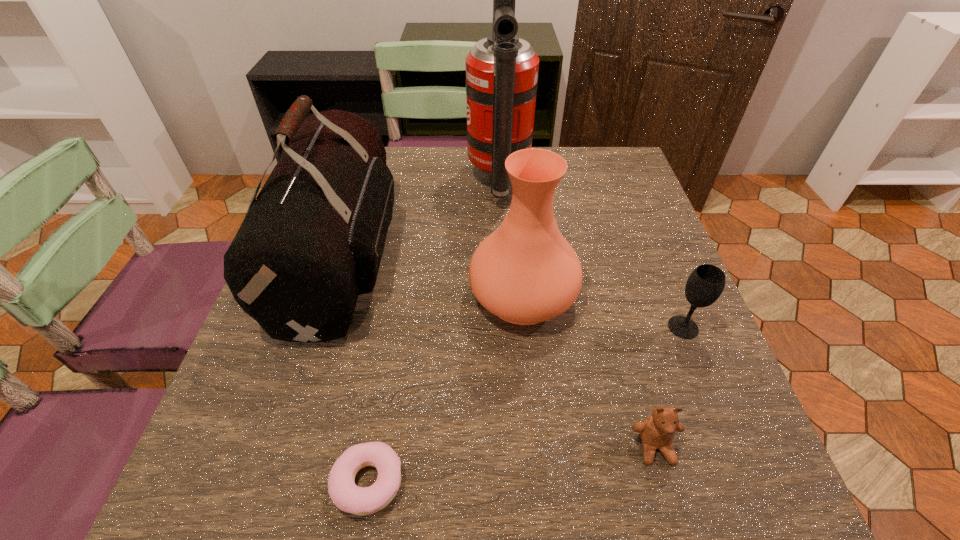
You are a GUI agent. You are given a task and a screenshot of the screen. Output one action in this format:
    pyautogui.click(x=<x>, y=<y>)
    Task: Click on the vacant region that satisfies the following two spatial constraints: 1. on the front pocket of the vase; 2. on the left side of the duffel bag
    
    Given the screenshot: What is the action you would take?
    pyautogui.click(x=330, y=296)

Where is `vacant space that satisfies the following two spatial constraints: 1. on the front pocket of the duffel bag; 2. on the back side of the rightmost object`? This screenshot has width=960, height=540. vacant space that satisfies the following two spatial constraints: 1. on the front pocket of the duffel bag; 2. on the back side of the rightmost object is located at coordinates (321, 327).

This screenshot has width=960, height=540. I want to click on free space that satisfies the following two spatial constraints: 1. on the front pocket of the fourth tallest object; 2. on the right side of the duffel bag, so click(x=321, y=327).

What are the coordinates of `vacant space that satisfies the following two spatial constraints: 1. on the back side of the third shortest object; 2. on the front label side of the tallest object` in the screenshot? It's located at (625, 181).